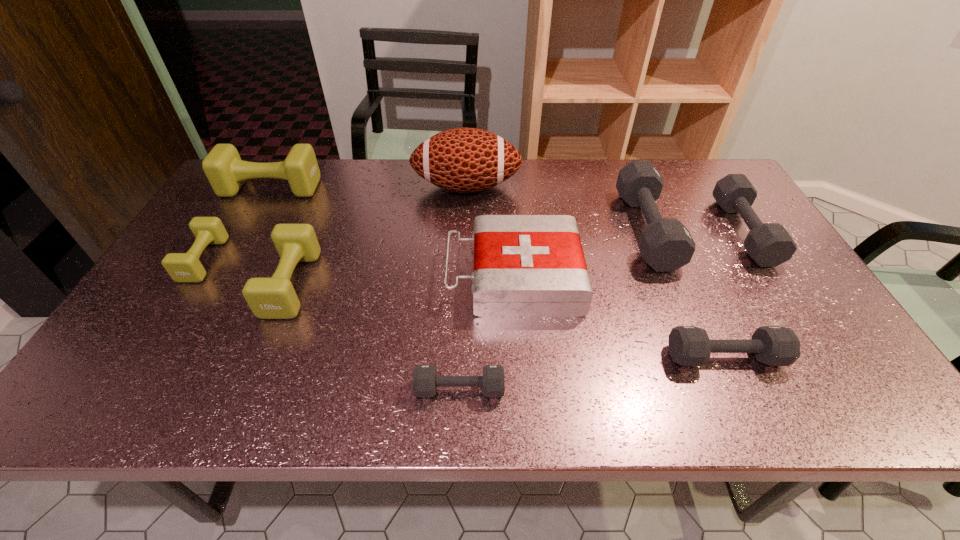
I want to click on football, so point(466,160).

The image size is (960, 540). What are the coordinates of `the farthest olive dumbbell` in the screenshot? It's located at click(x=223, y=167).

Where is `the biggest gray dumbbell`? The width and height of the screenshot is (960, 540). the biggest gray dumbbell is located at coordinates (665, 244).

Locate an element on the screen. Image resolution: width=960 pixels, height=540 pixels. the second smallest olive dumbbell is located at coordinates (268, 298).

Image resolution: width=960 pixels, height=540 pixels. I want to click on the rightmost gray dumbbell, so click(x=769, y=244).

Locate an element on the screen. The width and height of the screenshot is (960, 540). the second biggest gray dumbbell is located at coordinates (769, 244).

You are a GUI agent. You are given a task and a screenshot of the screen. Output one action in this format:
    pyautogui.click(x=<x>, y=<y>)
    Task: Click on the red first-aid kit
    The width and height of the screenshot is (960, 540).
    Given the screenshot: What is the action you would take?
    pyautogui.click(x=524, y=265)

Find the location of a particular element. The width and height of the screenshot is (960, 540). the second nearest object is located at coordinates (688, 345).

This screenshot has width=960, height=540. What are the coordinates of `the second smallest gray dumbbell` in the screenshot? It's located at (688, 345).

At what (x,y) coordinates should I click in order to perform the action: click on the smallest olive dumbbell. Please return your answer as a coordinate pair (x, y). The width and height of the screenshot is (960, 540). Looking at the image, I should click on (186, 267).